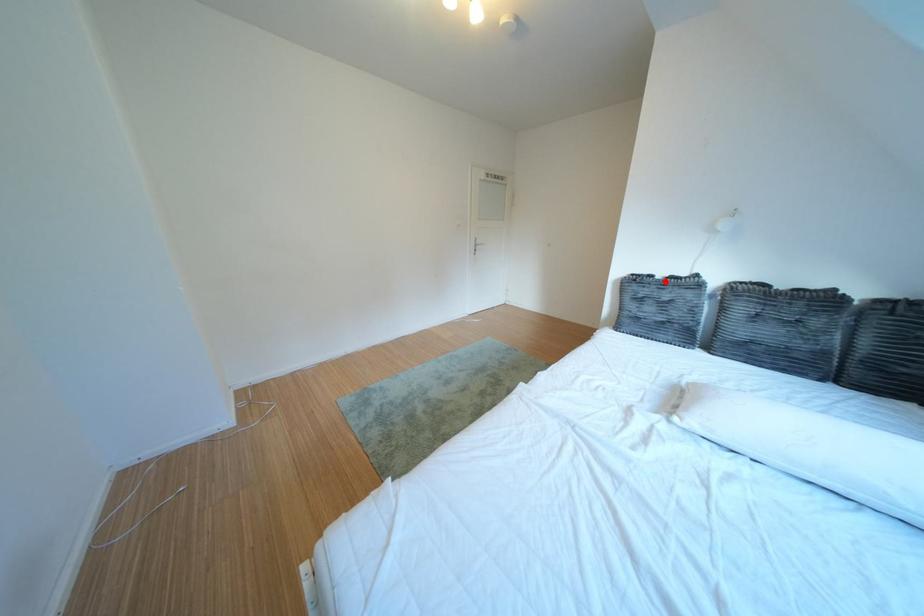
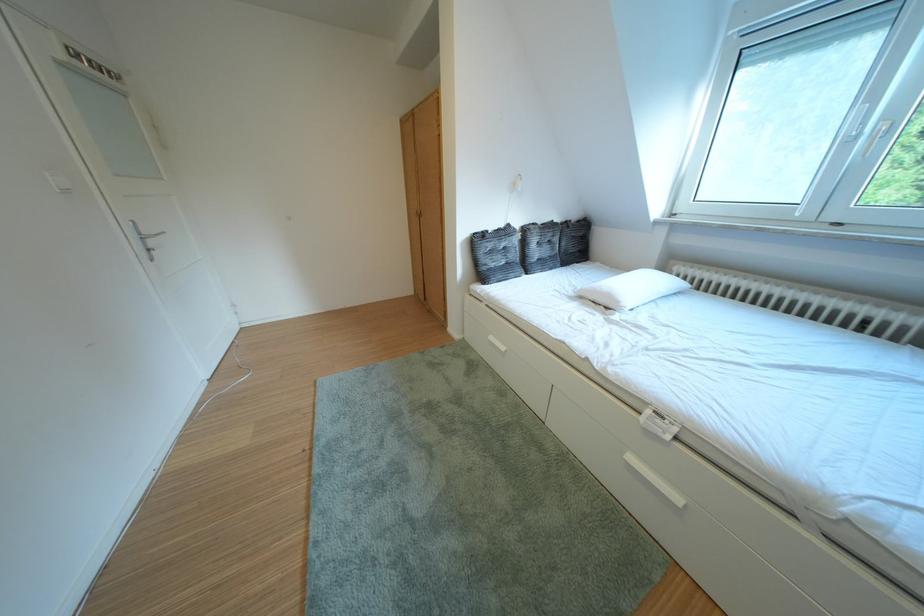
Where in the second image is the point corresponding to the highlighted location from the first image?

(500, 237)